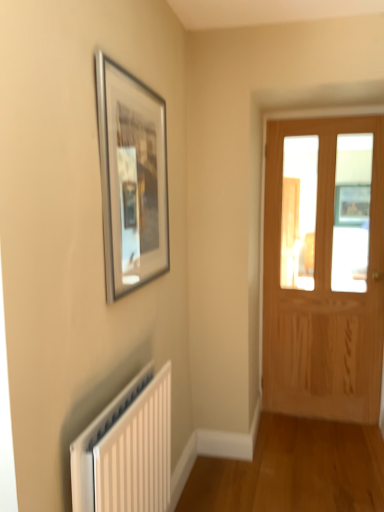
Question: Is silver metallic picture frame at upper left completely or partially outside of white plastic radiator at lower left?

Choices:
 (A) no
 (B) yes

Answer: (B)

Question: From a real-world perspective, is silver metallic picture frame at upper left located beneath white plastic radiator at lower left?

Choices:
 (A) no
 (B) yes

Answer: (A)

Question: From a real-world perspective, is silver metallic picture frame at upper left positioned over white plastic radiator at lower left based on gravity?

Choices:
 (A) yes
 (B) no

Answer: (A)

Question: Is silver metallic picture frame at upper left bigger than white plastic radiator at lower left?

Choices:
 (A) yes
 (B) no

Answer: (B)

Question: Would you consider silver metallic picture frame at upper left to be distant from white plastic radiator at lower left?

Choices:
 (A) no
 (B) yes

Answer: (A)

Question: From the image's perspective, is white plastic radiator at lower left located above or below light brown wooden door at right?

Choices:
 (A) above
 (B) below

Answer: (B)

Question: In the image, is white plastic radiator at lower left on the left side or the right side of light brown wooden door at right?

Choices:
 (A) right
 (B) left

Answer: (B)

Question: Looking at their shapes, would you say white plastic radiator at lower left is wider or thinner than light brown wooden door at right?

Choices:
 (A) thin
 (B) wide

Answer: (A)

Question: Is white plastic radiator at lower left spatially inside light brown wooden door at right, or outside of it?

Choices:
 (A) outside
 (B) inside

Answer: (A)

Question: From the image's perspective, is silver metallic picture frame at upper left above or below white plastic radiator at lower left?

Choices:
 (A) above
 (B) below

Answer: (A)

Question: Is silver metallic picture frame at upper left bigger or smaller than white plastic radiator at lower left?

Choices:
 (A) small
 (B) big

Answer: (A)

Question: Looking at their shapes, would you say silver metallic picture frame at upper left is wider or thinner than white plastic radiator at lower left?

Choices:
 (A) thin
 (B) wide

Answer: (A)

Question: Choose the correct answer: Is silver metallic picture frame at upper left inside white plastic radiator at lower left or outside it?

Choices:
 (A) outside
 (B) inside

Answer: (A)

Question: Considering the positions of silver metallic picture frame at upper left and light brown wooden door at right in the image, is silver metallic picture frame at upper left taller or shorter than light brown wooden door at right?

Choices:
 (A) short
 (B) tall

Answer: (A)

Question: From a real-world perspective, is silver metallic picture frame at upper left above or below light brown wooden door at right?

Choices:
 (A) above
 (B) below

Answer: (A)